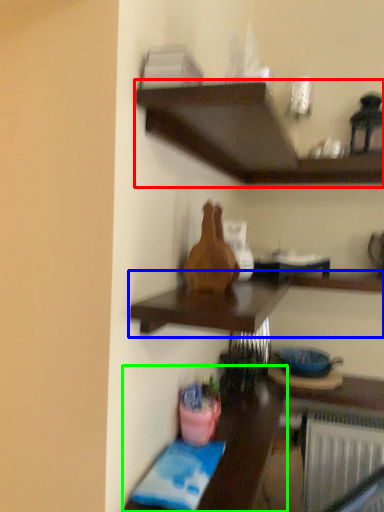
Question: Considering the real-world distances, which object is closest to shelf (highlighted by a red box)? shelf (highlighted by a blue box) or table (highlighted by a green box).

Choices:
 (A) shelf
 (B) table

Answer: (A)